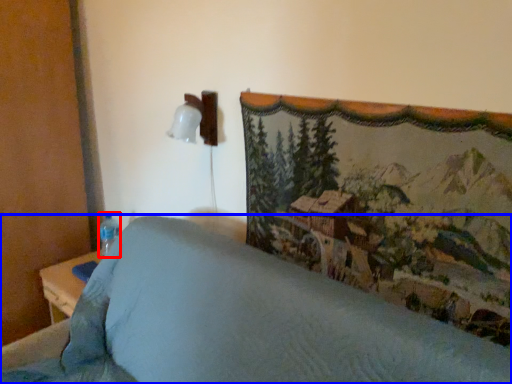
Question: Which object appears closest to the camera in this image, bottle (highlighted by a red box) or furniture (highlighted by a blue box)?

Choices:
 (A) bottle
 (B) furniture

Answer: (B)